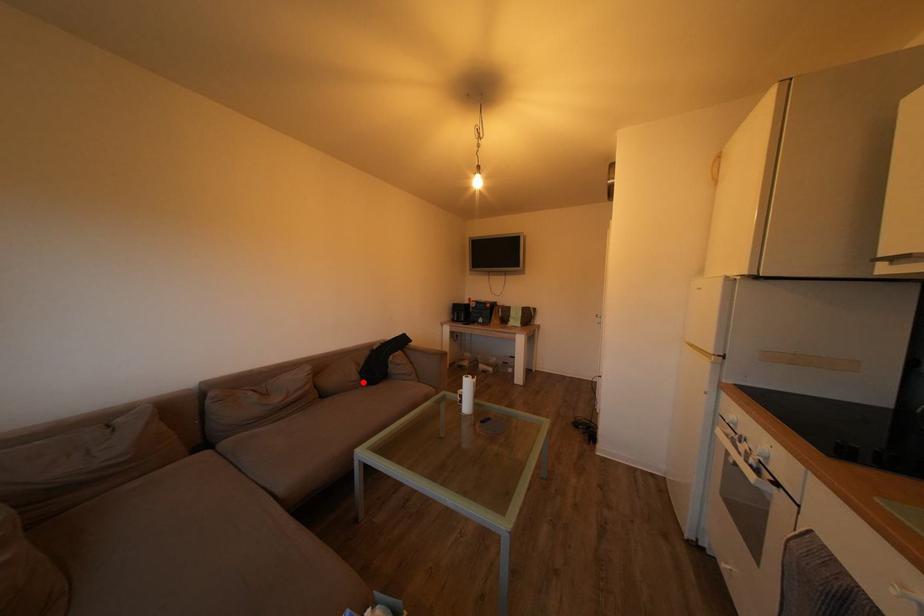
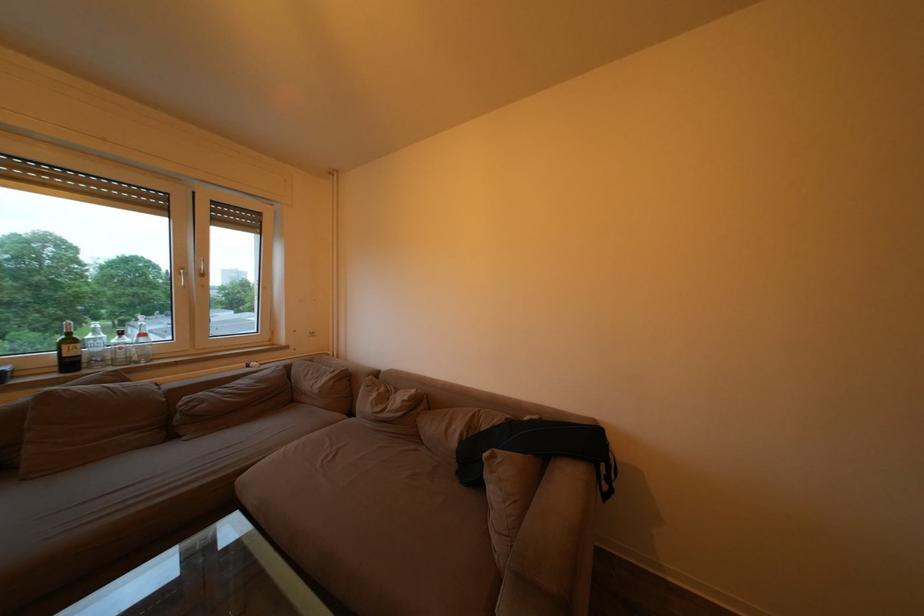
Question: A red point is marked in image1. In image2, is the corresponding 3D point closer to the camera or farther? Reply with the corresponding letter.

Choices:
 (A) The corresponding 3D point is closer.
 (B) The corresponding 3D point is farther.

Answer: (B)